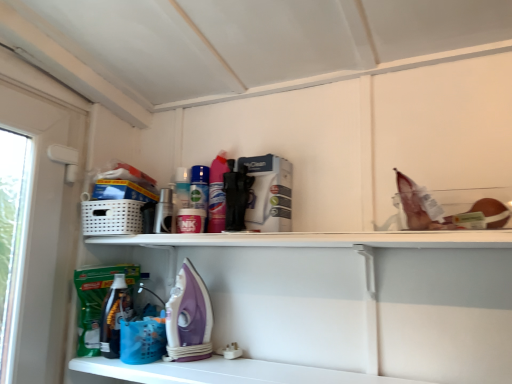
Question: Does blue plastic basket at lower center appear on the right side of purple plastic iron at lower center?

Choices:
 (A) yes
 (B) no

Answer: (B)

Question: Is blue plastic basket at lower center oriented towards purple plastic iron at lower center?

Choices:
 (A) no
 (B) yes

Answer: (A)

Question: From a real-world perspective, does blue plastic basket at lower center stand above purple plastic iron at lower center?

Choices:
 (A) yes
 (B) no

Answer: (B)

Question: Is blue plastic basket at lower center further to camera compared to purple plastic iron at lower center?

Choices:
 (A) no
 (B) yes

Answer: (B)

Question: Can you confirm if blue plastic basket at lower center is smaller than purple plastic iron at lower center?

Choices:
 (A) yes
 (B) no

Answer: (A)

Question: From the image's perspective, is blue plastic basket at lower center beneath purple plastic iron at lower center?

Choices:
 (A) no
 (B) yes

Answer: (B)

Question: From the image's perspective, does purple plastic iron at lower center appear lower than blue plastic basket at lower center?

Choices:
 (A) yes
 (B) no

Answer: (B)

Question: From a real-world perspective, is purple plastic iron at lower center positioned under blue plastic basket at lower center based on gravity?

Choices:
 (A) yes
 (B) no

Answer: (B)

Question: Considering the relative positions of purple plastic iron at lower center and blue plastic basket at lower center in the image provided, is purple plastic iron at lower center to the right of blue plastic basket at lower center from the viewer's perspective?

Choices:
 (A) yes
 (B) no

Answer: (A)

Question: Does purple plastic iron at lower center touch blue plastic basket at lower center?

Choices:
 (A) yes
 (B) no

Answer: (A)

Question: Is purple plastic iron at lower center in front of blue plastic basket at lower center?

Choices:
 (A) yes
 (B) no

Answer: (A)

Question: Is purple plastic iron at lower center thinner than blue plastic basket at lower center?

Choices:
 (A) yes
 (B) no

Answer: (A)

Question: Is white glossy shelf at lower center shorter than purple plastic iron at lower center?

Choices:
 (A) no
 (B) yes

Answer: (B)